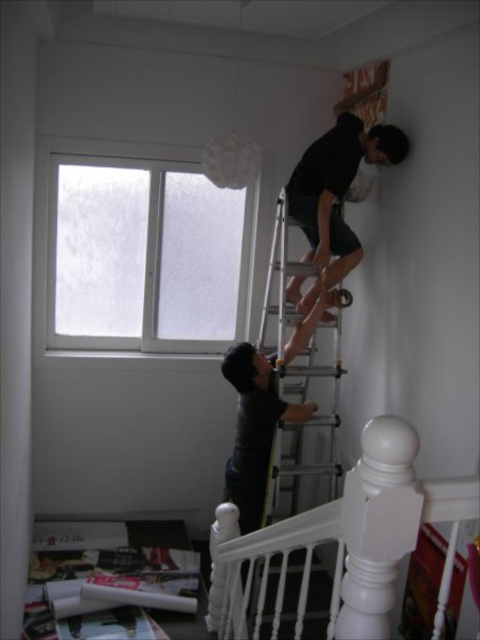
Question: Among these points, which one is farthest from the camera?

Choices:
 (A) (229, 280)
 (B) (326, 413)

Answer: (A)

Question: Is white glossy handrail at upper center closer to camera compared to silver metallic ladder at upper center?

Choices:
 (A) no
 (B) yes

Answer: (B)

Question: Considering the relative positions of silver metallic ladder at upper center and black matte shirt at upper right in the image provided, where is silver metallic ladder at upper center located with respect to black matte shirt at upper right?

Choices:
 (A) above
 (B) below

Answer: (B)

Question: Does white glossy handrail at upper center appear on the left side of black matte shirt at upper right?

Choices:
 (A) no
 (B) yes

Answer: (B)

Question: Which object is positioned closest to the transparent glass window at upper left?

Choices:
 (A) white glossy handrail at upper center
 (B) silver metallic ladder at upper center
 (C) black matte shirt at upper right

Answer: (B)

Question: Estimate the real-world distances between objects in this image. Which object is closer to the black matte shirt at upper right?

Choices:
 (A) silver metallic ladder at upper center
 (B) transparent glass window at upper left
 (C) white glossy handrail at upper center

Answer: (A)